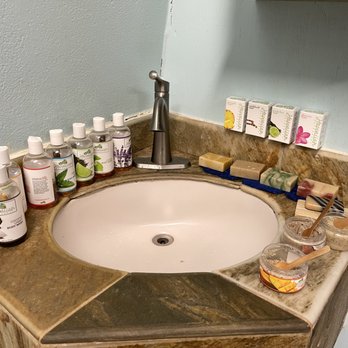
Where is `ceramic sink`? This screenshot has height=348, width=348. ceramic sink is located at coordinates (165, 206).